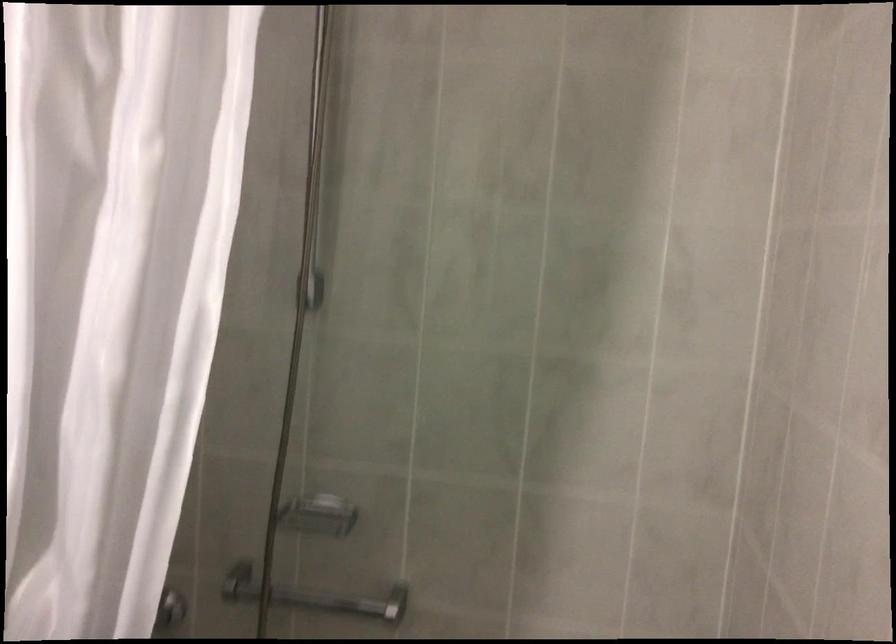
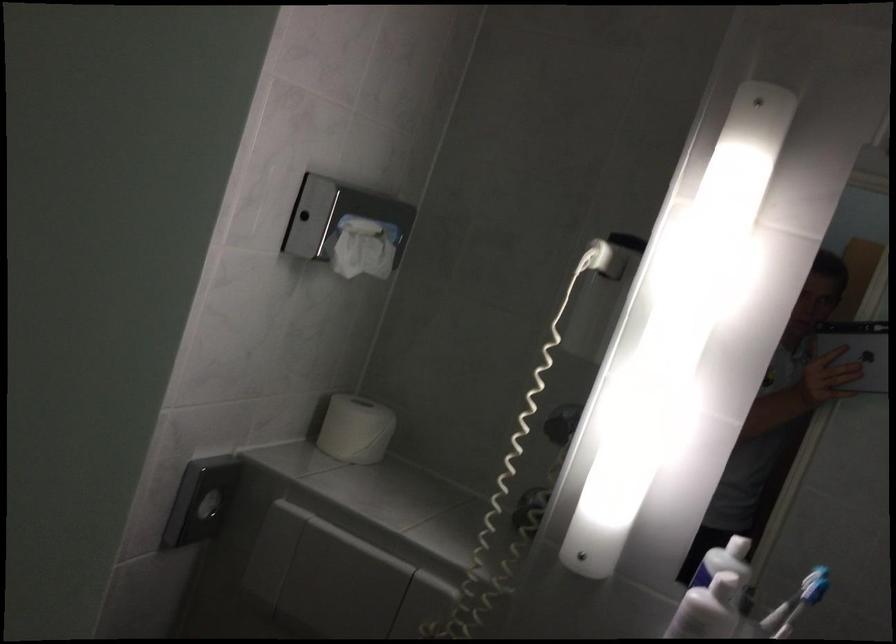
Question: The first image is from the beginning of the video and the second image is from the end. How did the camera likely rotate when shooting the video?

Choices:
 (A) Left
 (B) Right
 (C) Up
 (D) Down

Answer: (A)